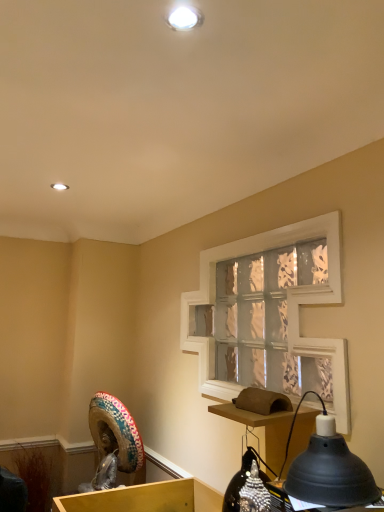
Question: From their relative heights in the image, would you say clear glass window screen at center is taller or shorter than matte white recessed light at upper center?

Choices:
 (A) tall
 (B) short

Answer: (A)

Question: Relative to matte white recessed light at upper center, is clear glass window screen at center in front or behind?

Choices:
 (A) behind
 (B) front

Answer: (B)

Question: Which object is positioned closest to the black matte lamp at lower right?

Choices:
 (A) multicolored fabric sombrero at lower left
 (B) brown cardboard table at lower right
 (C) clear glass window screen at center
 (D) matte white recessed light at upper center

Answer: (B)

Question: Which is farther from the multicolored fabric sombrero at lower left?

Choices:
 (A) brown cardboard table at lower right
 (B) clear glass window screen at center
 (C) black matte lamp at lower right
 (D) matte white recessed light at upper center

Answer: (D)